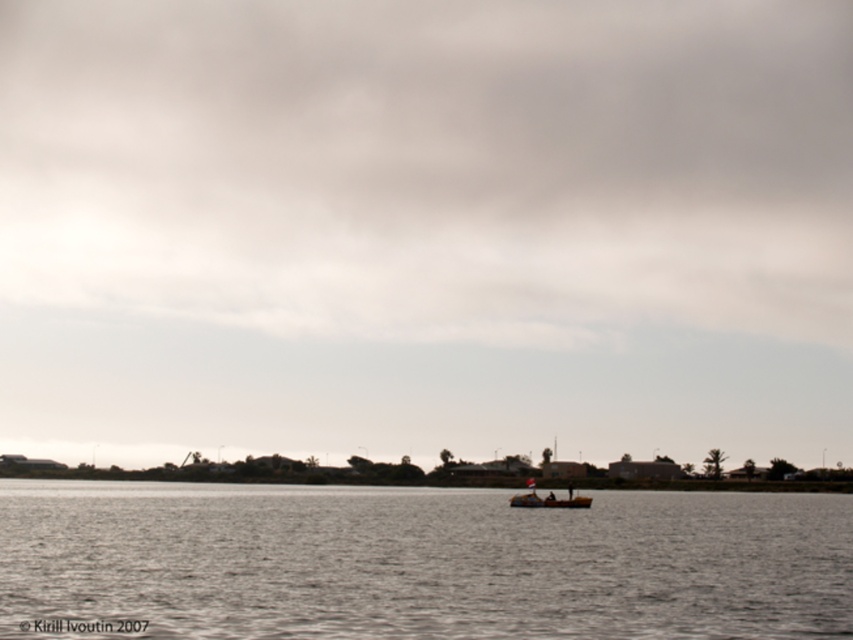
Question: Which point is farther to the camera?

Choices:
 (A) (664, 108)
 (B) (520, 500)
 (C) (163, 545)

Answer: (A)

Question: Is gray water at center positioned in front of wooden boat at center?

Choices:
 (A) no
 (B) yes

Answer: (B)

Question: Can you confirm if matte gray sky at center is positioned to the left of gray water at center?

Choices:
 (A) no
 (B) yes

Answer: (B)

Question: Which of the following is the farthest from the observer?

Choices:
 (A) (531, 502)
 (B) (155, 20)

Answer: (B)

Question: Which point appears closest to the camera in this image?

Choices:
 (A) (573, 504)
 (B) (22, 556)
 (C) (816, 212)

Answer: (B)

Question: In this image, where is matte gray sky at center located relative to wooden boat at center?

Choices:
 (A) above
 (B) below

Answer: (A)